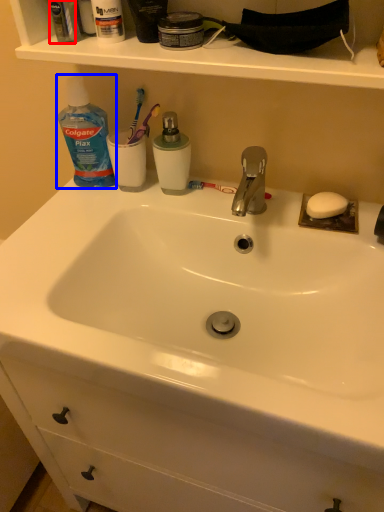
Question: Among these objects, which one is farthest to the camera, mouthwash (highlighted by a red box) or cleaning product (highlighted by a blue box)?

Choices:
 (A) mouthwash
 (B) cleaning product

Answer: (B)